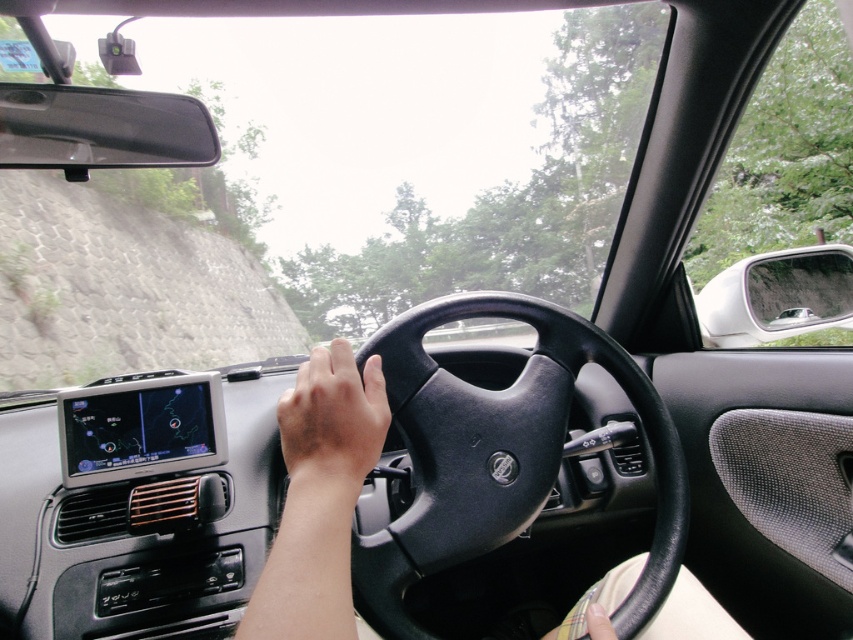
In the scene shown: Can you confirm if black matte steering wheel at center is thinner than brown matte hand at center?

In fact, black matte steering wheel at center might be wider than brown matte hand at center.

What do you see at coordinates (498, 452) in the screenshot? Image resolution: width=853 pixels, height=640 pixels. I see `black matte steering wheel at center` at bounding box center [498, 452].

Where is `black matte steering wheel at center`? black matte steering wheel at center is located at coordinates (498, 452).

From the picture: How far apart are black matte steering wheel at center and gray stone wall at upper left?

black matte steering wheel at center and gray stone wall at upper left are 11.90 meters apart from each other.

How much distance is there between black matte steering wheel at center and gray stone wall at upper left?

11.90 meters

Between point (431, 520) and point (55, 189), which one is positioned behind?

Positioned behind is point (55, 189).

Locate an element on the screen. The height and width of the screenshot is (640, 853). black matte steering wheel at center is located at coordinates (498, 452).

Is gray stone wall at upper left positioned before brown matte hand at center?

That is False.

Describe the element at coordinates (122, 289) in the screenshot. The height and width of the screenshot is (640, 853). I see `gray stone wall at upper left` at that location.

Which is behind, point (218, 358) or point (309, 428)?

Point (218, 358)

This screenshot has width=853, height=640. In order to click on gray stone wall at upper left in this screenshot , I will do `click(122, 289)`.